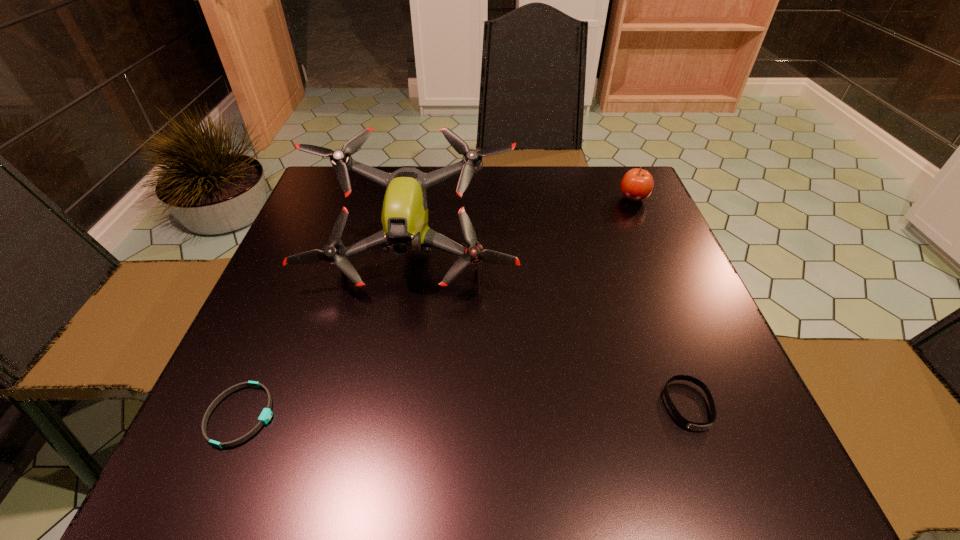
I want to click on vacant point located on the buckle of the shorter wristband, so click(x=416, y=415).

What are the coordinates of `object present at the far edge` in the screenshot? It's located at (637, 184).

Find the location of a particular element. drone that is positioned at the left edge is located at coordinates (404, 218).

This screenshot has width=960, height=540. Identify the location of wristband located in the left edge section of the desktop. (266, 414).

Locate an element on the screen. apple that is positioned at the right edge is located at coordinates (637, 184).

Locate an element on the screen. The image size is (960, 540). wristband located at the right edge is located at coordinates (695, 426).

Image resolution: width=960 pixels, height=540 pixels. What are the coordinates of `object that is at the near left corner` in the screenshot? It's located at (266, 414).

Locate an element on the screen. Image resolution: width=960 pixels, height=540 pixels. object at the far right corner is located at coordinates (637, 184).

This screenshot has width=960, height=540. Find the location of `object that is at the near right corner`. object that is at the near right corner is located at coordinates (695, 426).

This screenshot has height=540, width=960. In the image, there is a desktop. Identify the location of vacant space at the far edge. (547, 166).